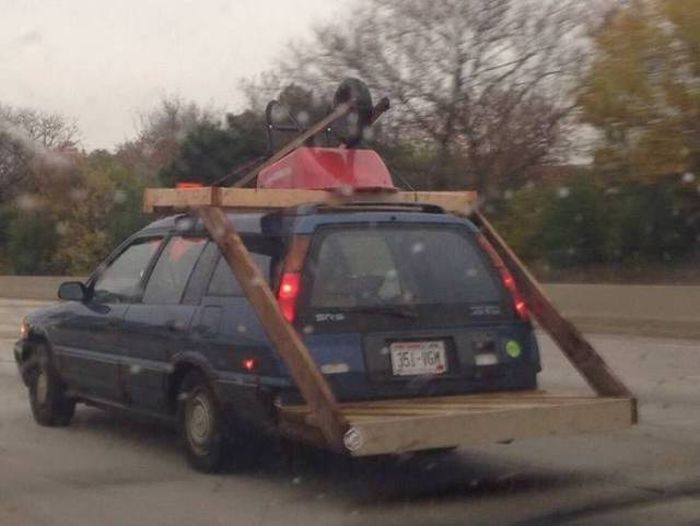
Find the location of a particular element. This screenshot has width=700, height=526. mirror is located at coordinates (71, 294).